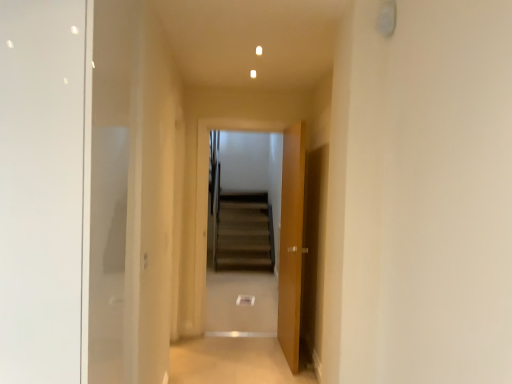
Question: Is wooden door at center taller than brown carpeted stairs at center?

Choices:
 (A) no
 (B) yes

Answer: (A)

Question: Is wooden door at center turned away from brown carpeted stairs at center?

Choices:
 (A) yes
 (B) no

Answer: (B)

Question: Can you confirm if wooden door at center is positioned to the right of brown carpeted stairs at center?

Choices:
 (A) no
 (B) yes

Answer: (B)

Question: Is wooden door at center bigger than brown carpeted stairs at center?

Choices:
 (A) no
 (B) yes

Answer: (B)

Question: Can we say wooden door at center lies outside brown carpeted stairs at center?

Choices:
 (A) no
 (B) yes

Answer: (B)

Question: Can you confirm if wooden door at center is smaller than brown carpeted stairs at center?

Choices:
 (A) yes
 (B) no

Answer: (B)

Question: Considering the relative sizes of brown carpeted stairs at center and wooden door at center in the image provided, is brown carpeted stairs at center bigger than wooden door at center?

Choices:
 (A) yes
 (B) no

Answer: (B)

Question: Is the depth of brown carpeted stairs at center greater than that of wooden door at center?

Choices:
 (A) yes
 (B) no

Answer: (A)

Question: Does brown carpeted stairs at center have a greater width compared to wooden door at center?

Choices:
 (A) no
 (B) yes

Answer: (A)

Question: From a real-world perspective, is brown carpeted stairs at center below wooden door at center?

Choices:
 (A) no
 (B) yes

Answer: (A)

Question: From a real-world perspective, is brown carpeted stairs at center located higher than wooden door at center?

Choices:
 (A) yes
 (B) no

Answer: (A)

Question: Is wooden door at center at the back of brown carpeted stairs at center?

Choices:
 (A) no
 (B) yes

Answer: (A)

Question: Considering the relative positions of beige carpet at center and brown carpeted stairs at center in the image provided, is beige carpet at center to the left of brown carpeted stairs at center from the viewer's perspective?

Choices:
 (A) no
 (B) yes

Answer: (B)